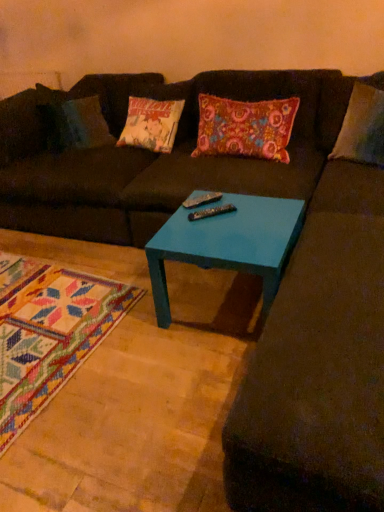
Find the location of `free point behind black plastic remote at center, the second remote when ordered from back to front`. free point behind black plastic remote at center, the second remote when ordered from back to front is located at coordinates (214, 202).